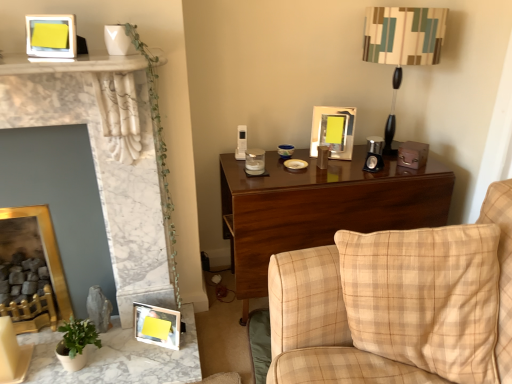
Locate an element on the screen. The width and height of the screenshot is (512, 384). free area in between wooden photo frame at lower left, which is the 3th picture frame from left to right, and green matte plant at lower left is located at coordinates (126, 347).